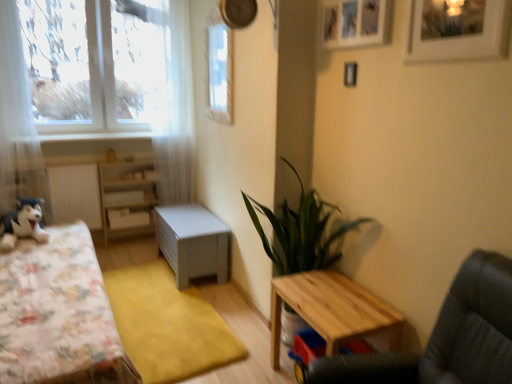
You are a GUI agent. You are given a task and a screenshot of the screen. Output one action in this format:
    pyautogui.click(x=<x>, y=<y>)
    Task: Click on the vacant space in front of white painted wood dresser at center
    
    Given the screenshot: What is the action you would take?
    pyautogui.click(x=130, y=254)